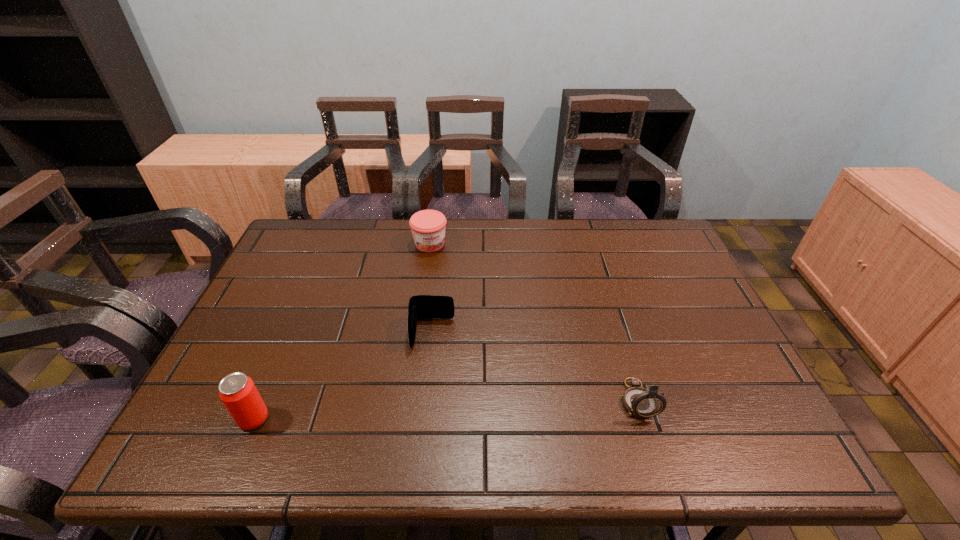
Where is `beer can`? The width and height of the screenshot is (960, 540). beer can is located at coordinates (237, 391).

This screenshot has width=960, height=540. I want to click on compass, so click(x=642, y=403).

The height and width of the screenshot is (540, 960). I want to click on the farthest object, so click(428, 227).

Find the location of a particular element. Image resolution: width=960 pixels, height=540 pixels. the shortest object is located at coordinates (420, 306).

Find the location of a particular element. wallet is located at coordinates (420, 306).

The width and height of the screenshot is (960, 540). I want to click on vacant space located 0.110m on the left of the beer can, so click(x=188, y=419).

Identify the location of free space located 0.090m on the front label of the farthest object. The height and width of the screenshot is (540, 960). (442, 272).

In order to click on vacant space located 0.370m on the front label of the farthest object in this screenshot , I will do `click(470, 339)`.

You are a GUI agent. You are given a task and a screenshot of the screen. Output one action in this format:
    pyautogui.click(x=<x>, y=<y>)
    Task: Click on the free spot located on the front label of the farthest object
    This screenshot has height=540, width=960.
    Given the screenshot: What is the action you would take?
    pyautogui.click(x=441, y=269)

Find the location of `free region located on the outer surface of the second farthest object`. free region located on the outer surface of the second farthest object is located at coordinates (428, 396).